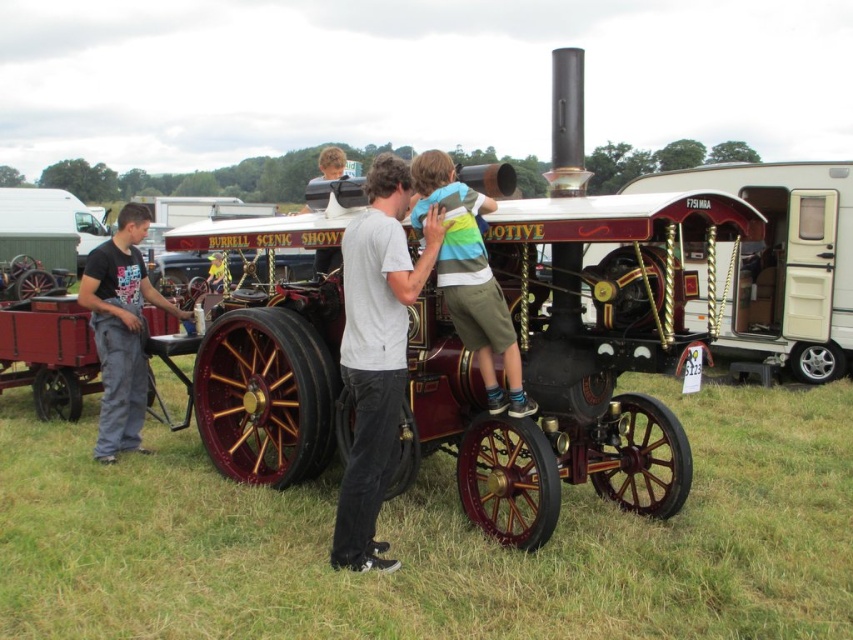
Consider the image. Can you confirm if light gray cotton t-shirt at center is positioned below striped cotton shirt at center?

Yes, light gray cotton t-shirt at center is below striped cotton shirt at center.

What do you see at coordinates (376, 352) in the screenshot?
I see `light gray cotton t-shirt at center` at bounding box center [376, 352].

What do you see at coordinates (376, 352) in the screenshot?
I see `light gray cotton t-shirt at center` at bounding box center [376, 352].

Identify the location of light gray cotton t-shirt at center. The height and width of the screenshot is (640, 853). tap(376, 352).

From the picture: Is striped cotton shirt at center to the right of dark gray jeans at left from the viewer's perspective?

Correct, you'll find striped cotton shirt at center to the right of dark gray jeans at left.

Can you confirm if striped cotton shirt at center is taller than dark gray jeans at left?

No.

Does point (473, 266) come closer to viewer compared to point (109, 410)?

Yes, it is.

Image resolution: width=853 pixels, height=640 pixels. In order to click on striped cotton shirt at center in this screenshot , I will do `click(469, 276)`.

Can you confirm if light gray cotton t-shirt at center is wider than dark gray jeans at left?

Incorrect, light gray cotton t-shirt at center's width does not surpass dark gray jeans at left's.

Does light gray cotton t-shirt at center appear over dark gray jeans at left?

No, light gray cotton t-shirt at center is not above dark gray jeans at left.

I want to click on light gray cotton t-shirt at center, so click(x=376, y=352).